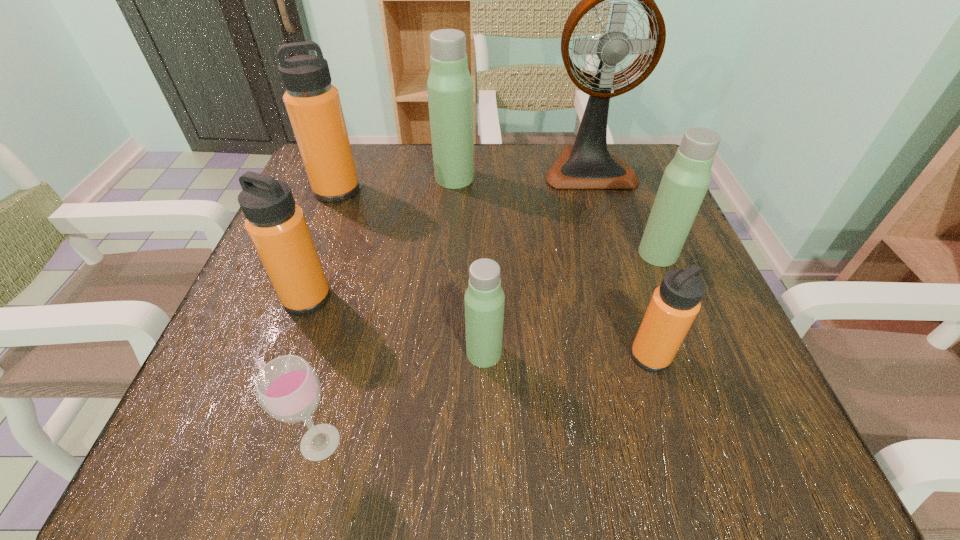
Where is `empty location between the farthest light thermos bottle and the second smallest light thermos bottle`? Image resolution: width=960 pixels, height=540 pixels. empty location between the farthest light thermos bottle and the second smallest light thermos bottle is located at coordinates (556, 216).

Where is `object that is the sixth nearest to the biggest light thermos bottle`? The width and height of the screenshot is (960, 540). object that is the sixth nearest to the biggest light thermos bottle is located at coordinates (674, 305).

Identify the location of object that is the second closest to the biggest orange thermos bottle. The height and width of the screenshot is (540, 960). (277, 227).

Locate which thermos bottle ranks fifth in proximity to the third farthest thermos bottle. Please provide its 2D coordinates. Your answer should be formatted as a tuple, i.e. [(x, y)], where the tuple contains the x and y coordinates of a point satisfying the conditions above.

[(313, 104)]

Identify which thermos bottle is the fifth closest to the nearest object. Please provide its 2D coordinates. Your answer should be formatted as a tuple, i.e. [(x, y)], where the tuple contains the x and y coordinates of a point satisfying the conditions above.

[(449, 86)]

Locate an element on the screen. Image resolution: width=960 pixels, height=540 pixels. orange thermos bottle that stands as the second closest to the farthest light thermos bottle is located at coordinates (277, 227).

Image resolution: width=960 pixels, height=540 pixels. Identify the location of orange thermos bottle that stands as the closest to the fourth nearest object. (313, 104).

At what (x,y) coordinates should I click in order to perform the action: click on light thermos bottle that is the second closest to the rightmost thermos bottle. Please return your answer as a coordinate pair (x, y). Looking at the image, I should click on (449, 86).

Select which light thermos bottle is the second closest to the farthest light thermos bottle. Please provide its 2D coordinates. Your answer should be formatted as a tuple, i.e. [(x, y)], where the tuple contains the x and y coordinates of a point satisfying the conditions above.

[(484, 298)]

You are a GUI agent. You are given a task and a screenshot of the screen. Output one action in this format:
    pyautogui.click(x=<x>, y=<y>)
    Task: Click on the blank space that satisfies the following two spatial constraints: 1. on the back side of the nearest object; 2. on the left side of the farthest light thermos bottle
    The width and height of the screenshot is (960, 540).
    Given the screenshot: What is the action you would take?
    pyautogui.click(x=388, y=178)